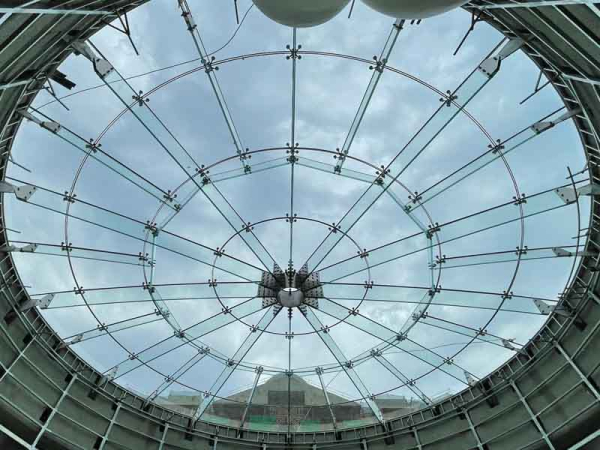
Find the location of a particular element. This screenshot has width=600, height=450. ceiling is located at coordinates (335, 285).